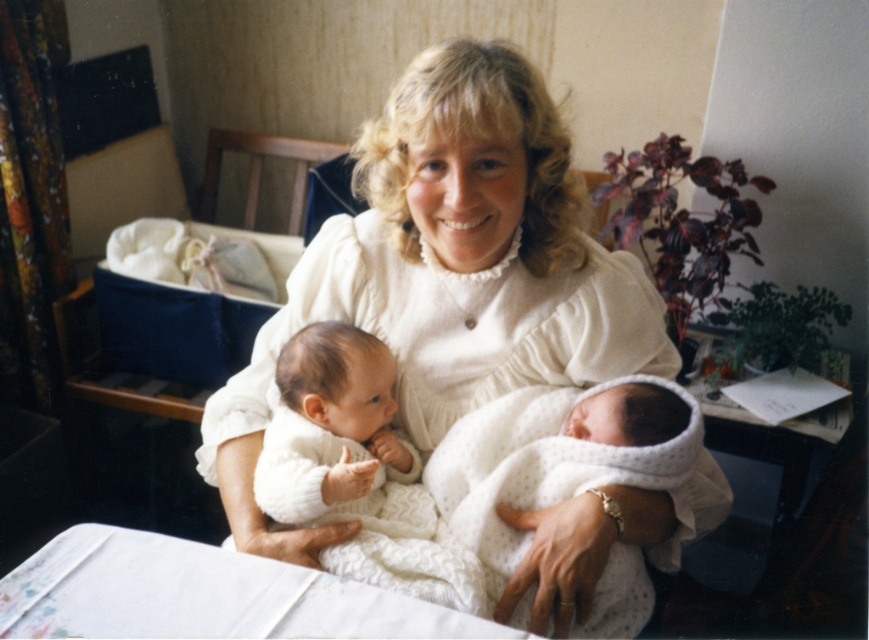
You are a photographer setting up for a family portrait. You notice the white knitted dress at center and the white knitted blanket at center in the scene. Which item is positioned higher relative to the other?

The white knitted dress at center is located above the white knitted blanket at center, so the dress is higher than the blanket.

You are a photographer setting up for a family photo. You notice the white knitted blanket at center and the white knitted sweater at center in the scene. Which object should you adjust to ensure there is enough space for the family members to sit comfortably?

The white knitted blanket at center might be wider than the white knitted sweater at center, so adjusting the blanket could provide more space for the family members to sit comfortably.

You are a photographer setting up for a family photo. The woman is holding two babies wrapped in white blankets. Where is the white knitted blanket at center positioned in relation to the camera? Please provide its coordinates as given in the description.

The white knitted blanket at center is located at point coordinates of (556, 458).